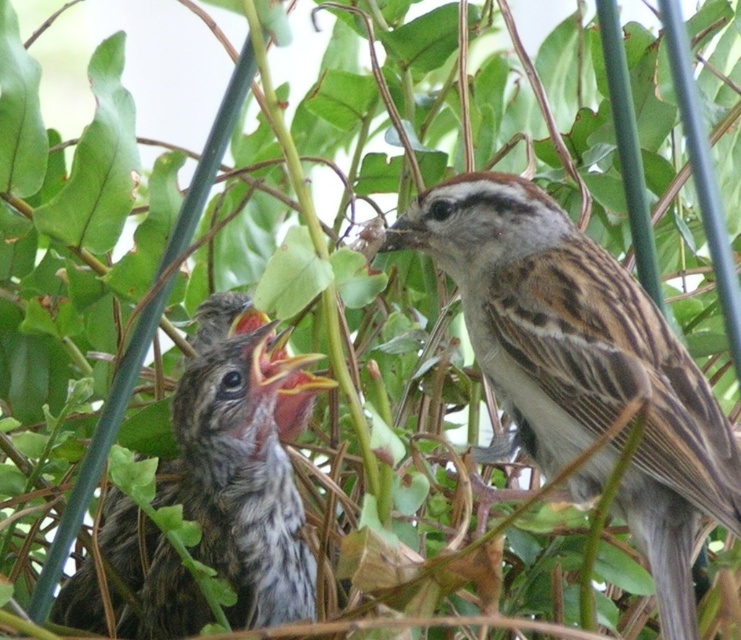
Question: Which point is farther to the camera?

Choices:
 (A) (205, 326)
 (B) (597, 305)

Answer: (A)

Question: Observing the image, what is the correct spatial positioning of brown speckled feathers at upper right in reference to speckled brown sparrow at center?

Choices:
 (A) left
 (B) right

Answer: (B)

Question: Is the position of brown speckled feathers at upper right less distant than that of speckled brown sparrow at center?

Choices:
 (A) yes
 (B) no

Answer: (A)

Question: Is brown speckled feathers at upper right wider than speckled brown sparrow at center?

Choices:
 (A) no
 (B) yes

Answer: (B)